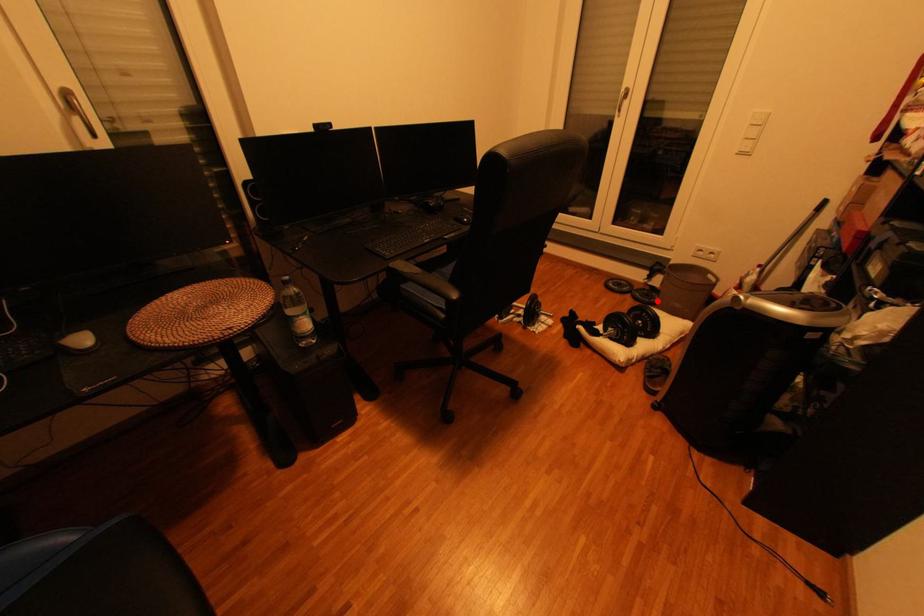
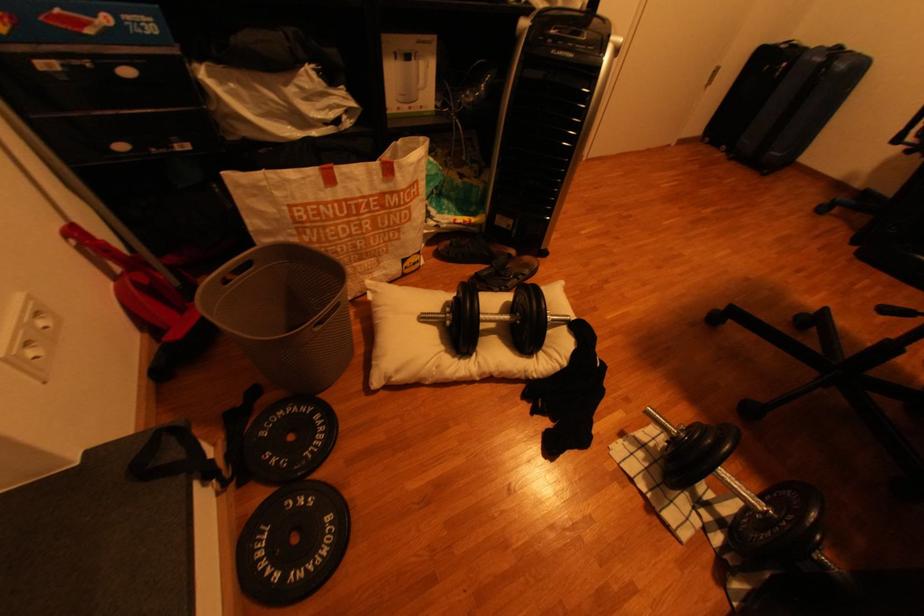
Question: I am providing you with two images of the same scene from different viewpoints. A red point is shown in image1. For the corresponding object point in image2, is it positioned nearer or farther from the camera?

Choices:
 (A) Nearer
 (B) Farther

Answer: (A)